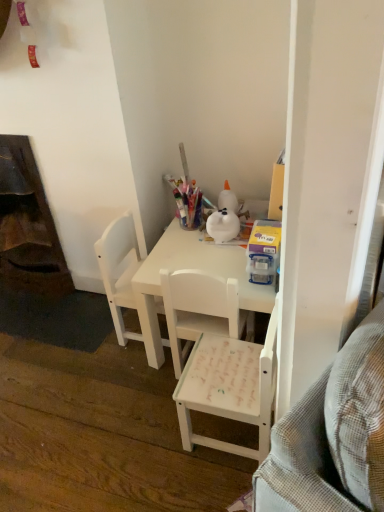
Locate an element on the screen. Image resolution: width=384 pixels, height=512 pixels. free location to the left of white matte chair at center, which is counted as the 1th chair, starting from the right is located at coordinates (147, 436).